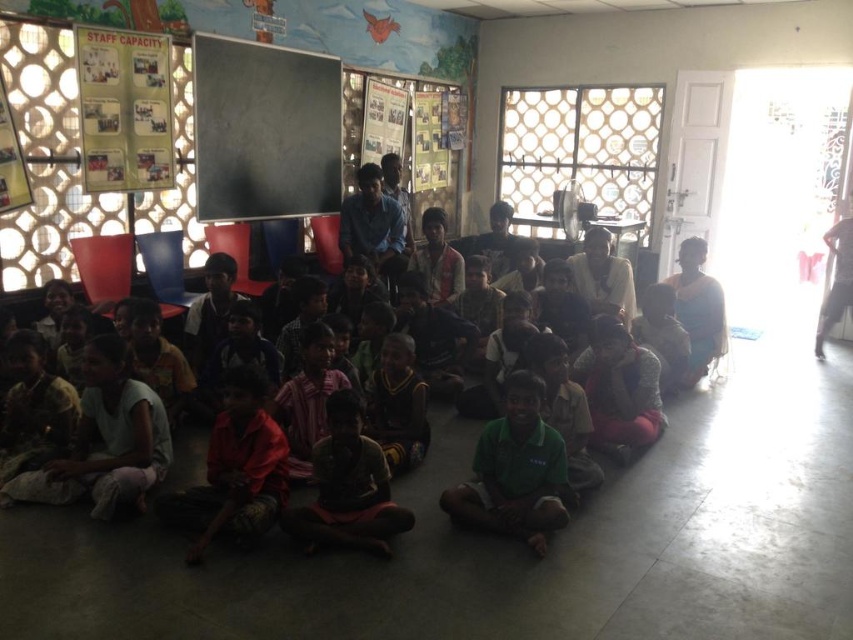
You are standing in the classroom and want to reach the point marked at coordinate point (560, 476). If your walking speed is 3 feet per second, how many seconds will it take you to reach that point?

The distance between you and point (560, 476) is 9.59 feet. At a speed of 3 feet per second, it would take approximately 3.197 seconds to reach the point.

You are a photographer trying to capture a clear shot of the dark green fabric shirt at center and the dark green fabric at lower center. Since both are dark green, how can you tell which one is closer to you?

The dark green fabric shirt at center is in front of the dark green fabric at lower center, so the shirt is closer to you.